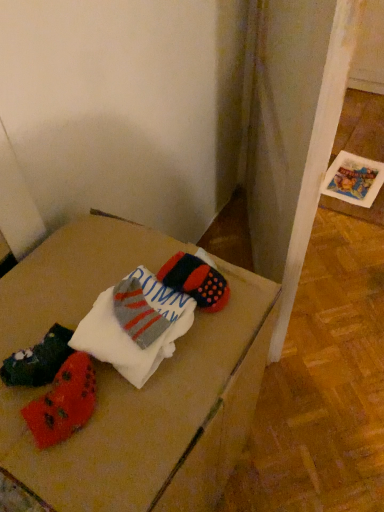
Locate an element on the screen. vacant space behind white cotton socks at center is located at coordinates (117, 253).